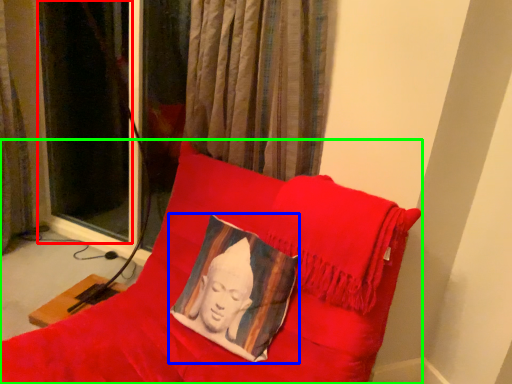
Question: Based on their relative distances, which object is farther from curtain (highlighted by a red box)? Choose from pillow (highlighted by a blue box) and furniture (highlighted by a green box).

Choices:
 (A) pillow
 (B) furniture

Answer: (A)